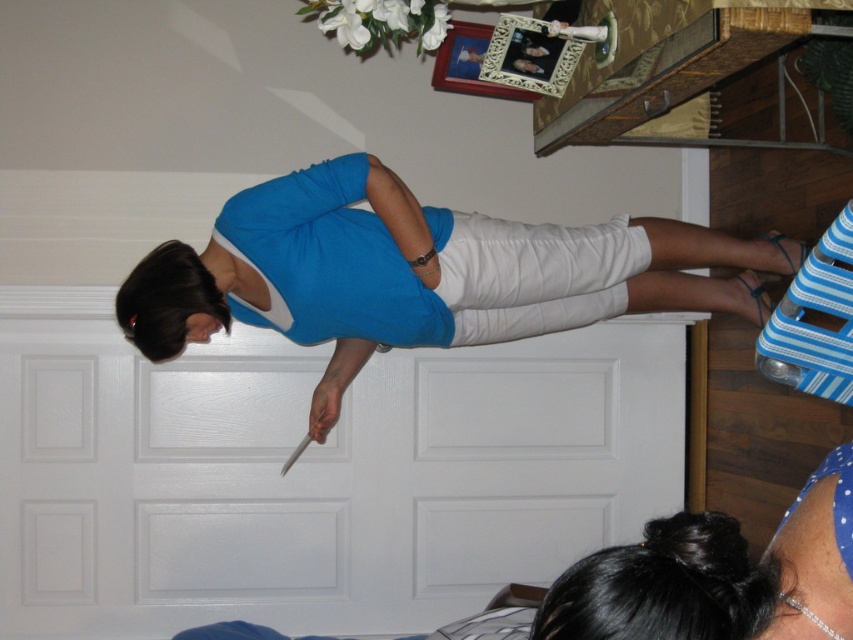
You are a fashion designer looking at this image. There is a point marked at coordinates (x=410, y=273). What item is located at that point?

The point at coordinates (x=410, y=273) indicates the blue cotton dress at center.

You are an interior designer assessing the layout of the room. You notice the blue cotton dress at center and the matte blue fabric dress at center. Which dress is closer to the floor?

The blue cotton dress at center is positioned under the matte blue fabric dress at center, so the blue cotton dress at center is closer to the floor.